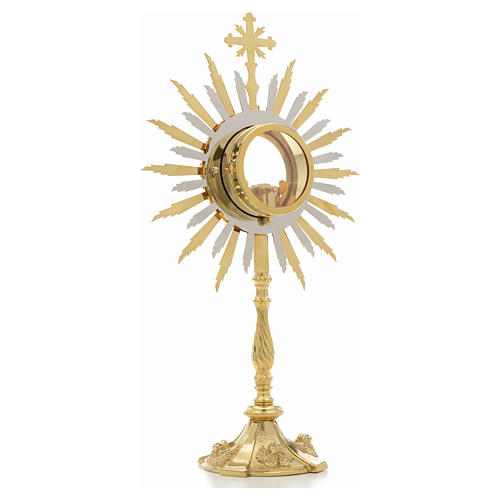
The height and width of the screenshot is (500, 500). Find the location of `stand`. stand is located at coordinates (261, 349).